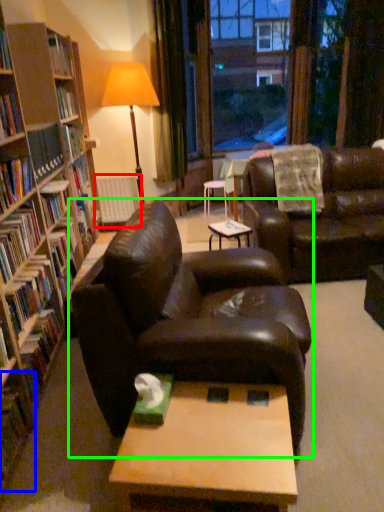
Question: Which is nearer to the radiator (highlighted by a red box)? book (highlighted by a blue box) or studio couch (highlighted by a green box).

Choices:
 (A) book
 (B) studio couch

Answer: (B)